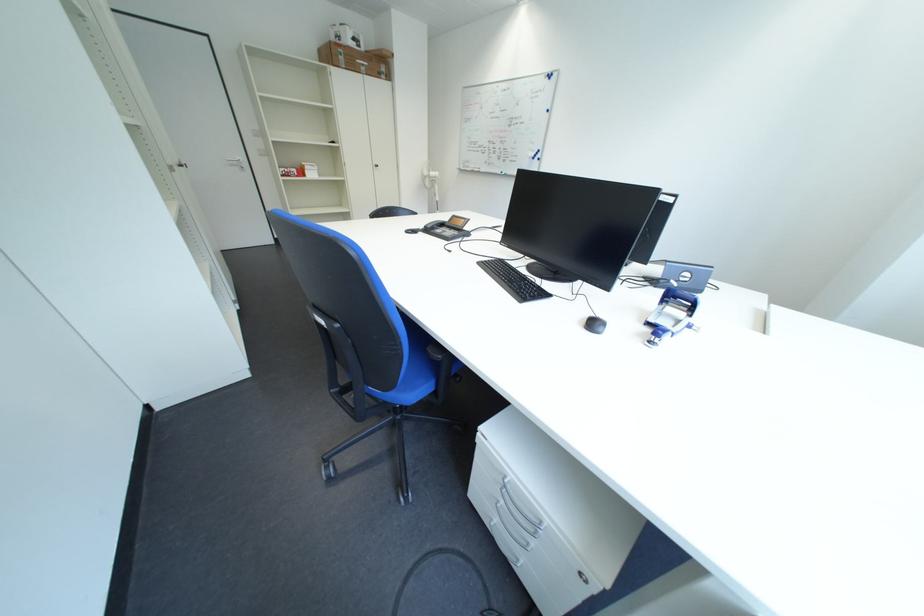
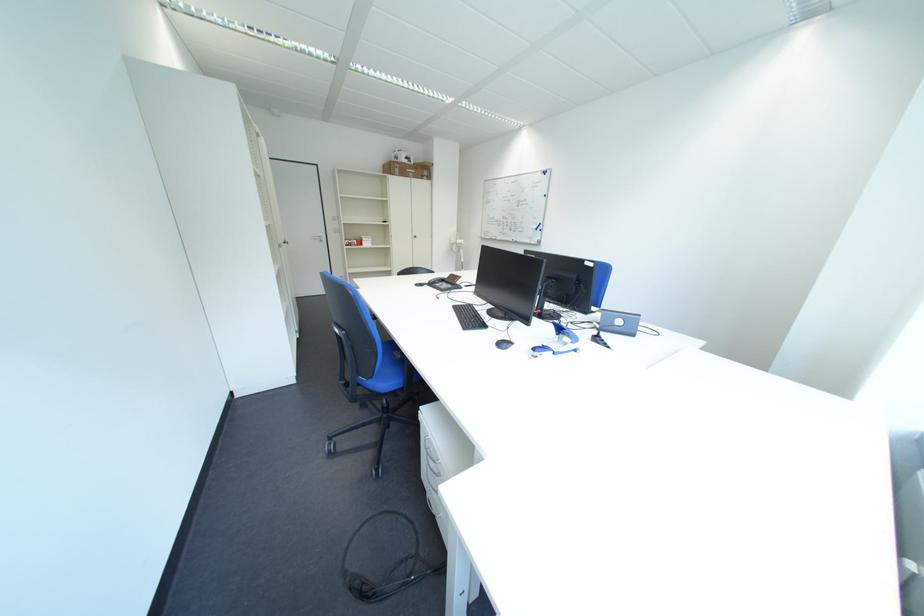
What movement of the cameraman would produce the second image?

The cameraman walked toward right, backward.